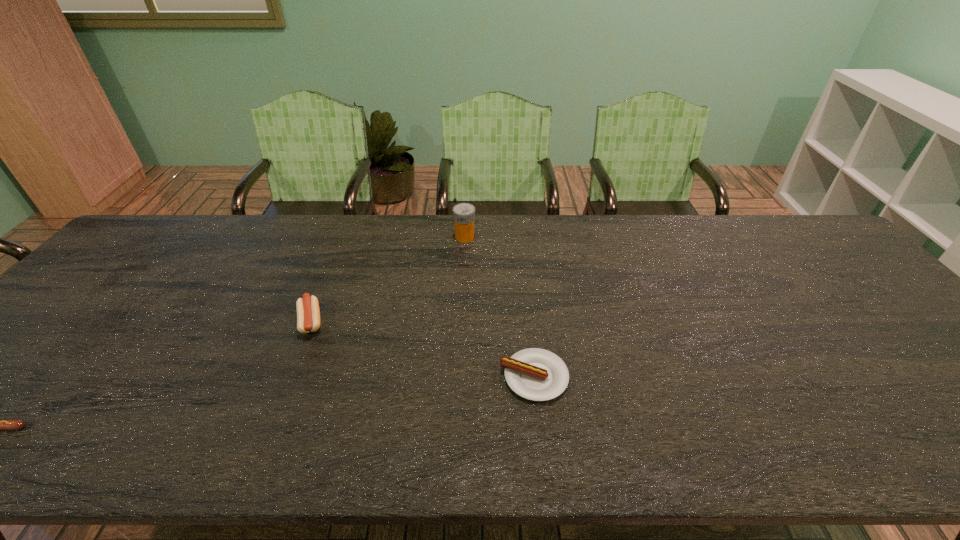
Locate an element on the screen. the tallest object is located at coordinates (463, 213).

At what (x,y) coordinates should I click in order to perform the action: click on medicine. Please return your answer as a coordinate pair (x, y). Looking at the image, I should click on (463, 213).

At what (x,y) coordinates should I click in order to perform the action: click on the farthest sausage. Please return your answer as a coordinate pair (x, y). This screenshot has width=960, height=540. Looking at the image, I should click on (308, 313).

Where is `the second sausage from right to left`? The image size is (960, 540). the second sausage from right to left is located at coordinates (308, 313).

You are a GUI agent. You are given a task and a screenshot of the screen. Output one action in this format:
    pyautogui.click(x=<x>, y=<y>)
    Task: Click on the second shortest object
    The image size is (960, 540).
    Given the screenshot: What is the action you would take?
    pyautogui.click(x=536, y=374)

What are the coordinates of `the second farthest sausage` in the screenshot? It's located at (536, 374).

Identify the location of vacant region located on the label side of the farthest object. (532, 237).

Locate an element on the screen. This screenshot has height=540, width=960. vacant space situated on the front of the second object from left to right is located at coordinates (288, 380).

Identify the location of vacant region located on the right of the rightmost sausage. The image size is (960, 540). (616, 377).

Where is `object situated at the far edge`? This screenshot has width=960, height=540. object situated at the far edge is located at coordinates (463, 213).